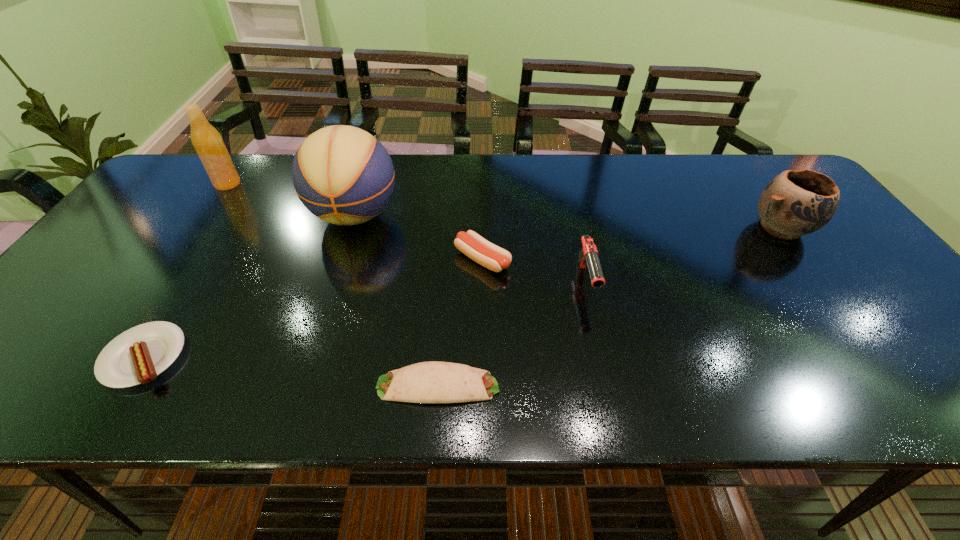
Where is `the fifth object from right to left`? the fifth object from right to left is located at coordinates (342, 174).

Locate an element on the screen. This screenshot has width=960, height=540. beer bottle is located at coordinates (207, 141).

Identify the location of the rightmost object. This screenshot has width=960, height=540. (795, 203).

What are the coordinates of `pottery` in the screenshot? It's located at (795, 203).

Locate an element on the screen. the second object from right to left is located at coordinates (588, 255).

The height and width of the screenshot is (540, 960). In order to click on the fourth shortest object in this screenshot , I will do `click(588, 255)`.

At what (x,y) coordinates should I click in order to perform the action: click on the third shortest object. Please return your answer as a coordinate pair (x, y). This screenshot has height=540, width=960. Looking at the image, I should click on (485, 253).

Where is `the taller sausage`? This screenshot has width=960, height=540. the taller sausage is located at coordinates 485,253.

In order to click on the shorter sausage in this screenshot , I will do [137, 356].

You are a GUI agent. You are given a task and a screenshot of the screen. Output one action in this format:
    pyautogui.click(x=<x>, y=<y>)
    Task: Click on the sixth tallest object
    The image size is (960, 540).
    Given the screenshot: What is the action you would take?
    pyautogui.click(x=137, y=356)